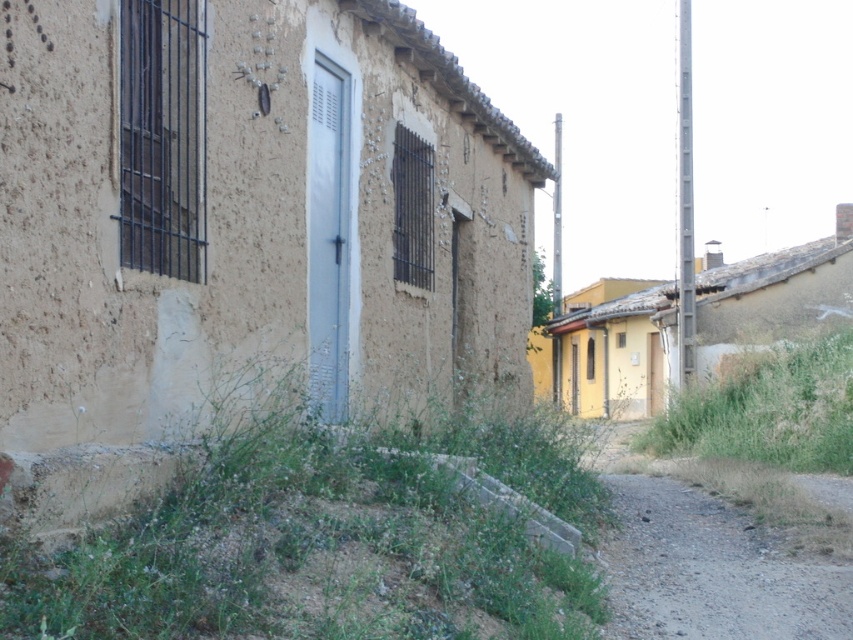
Question: Can you confirm if green grass at lower center is smaller than gray gravel path at lower right?

Choices:
 (A) yes
 (B) no

Answer: (B)

Question: Which point appears farthest from the camera in this image?

Choices:
 (A) (676, 529)
 (B) (335, 611)

Answer: (A)

Question: Which point is closer to the camera?

Choices:
 (A) gray gravel path at lower right
 (B) green grass at lower center

Answer: (B)

Question: Observing the image, what is the correct spatial positioning of green grass at lower center in reference to gray gravel path at lower right?

Choices:
 (A) below
 (B) above

Answer: (B)

Question: Which point is closer to the camera?

Choices:
 (A) gray gravel path at lower right
 (B) green grass at lower center

Answer: (B)

Question: Is green grass at lower center wider than gray gravel path at lower right?

Choices:
 (A) yes
 (B) no

Answer: (A)